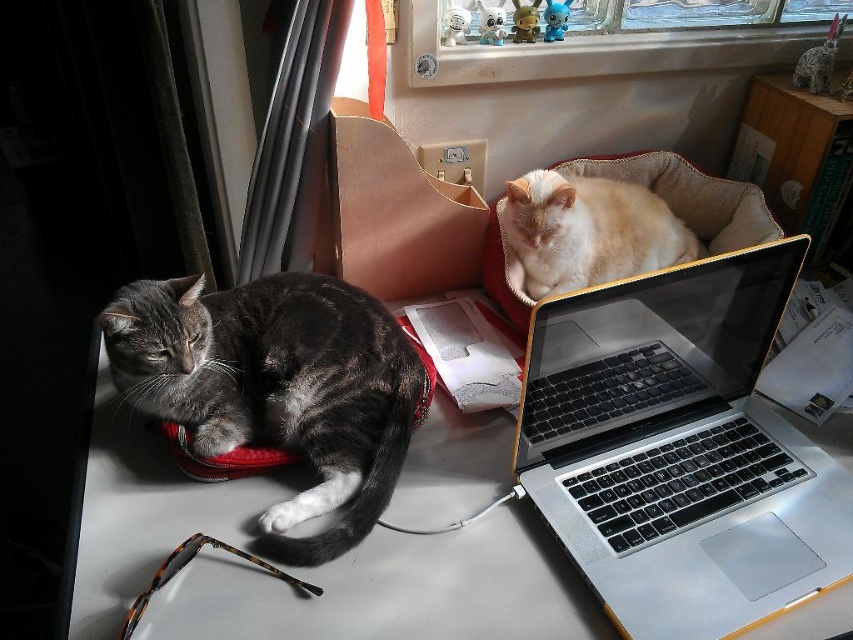
Question: Is silver metallic laptop at center smaller than white glossy table at lower left?

Choices:
 (A) no
 (B) yes

Answer: (B)

Question: Which object appears closest to the camera in this image?

Choices:
 (A) silver metallic laptop at center
 (B) orange fur cat at upper right

Answer: (A)

Question: Estimate the real-world distances between objects in this image. Which object is closer to the silver metallic laptop at center?

Choices:
 (A) white glossy table at lower left
 (B) gray fur cat at left
 (C) orange fur cat at upper right

Answer: (A)

Question: Is silver metallic laptop at center above gray fur cat at left?

Choices:
 (A) no
 (B) yes

Answer: (A)

Question: Can you confirm if silver metallic laptop at center is thinner than orange fur cat at upper right?

Choices:
 (A) no
 (B) yes

Answer: (A)

Question: Which of the following is the farthest from the observer?

Choices:
 (A) (354, 500)
 (B) (561, 301)
 (C) (534, 259)

Answer: (C)